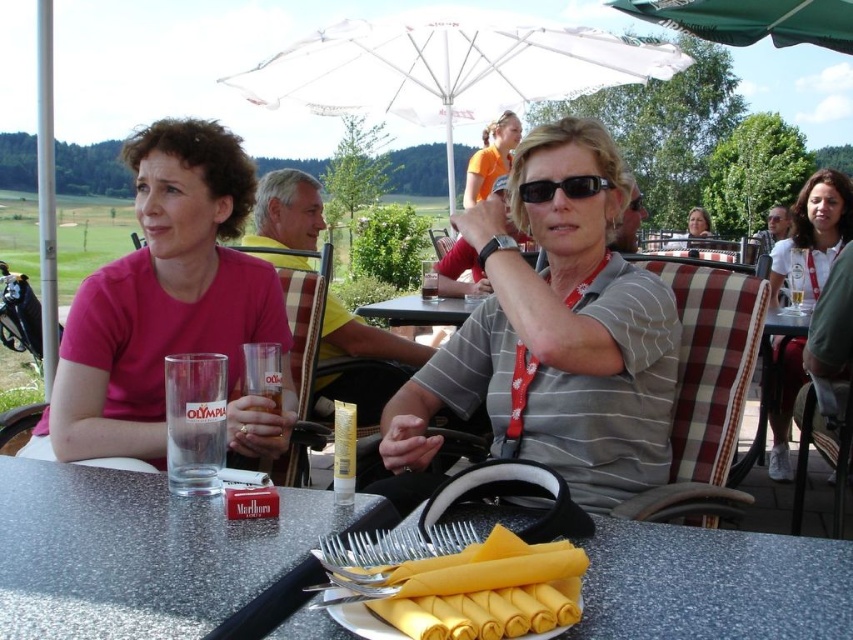
Looking at this image, you are a photographer trying to capture a shot of the gray striped shirt at center and the white fabric umbrella at upper center. Since you want both subjects in the frame, which direction should you move your camera to include both?

The gray striped shirt at center is to the right of the white fabric umbrella at upper center, so you should move your camera to the left to include both subjects in the frame.

You are a photographer trying to capture a photo of the gray striped shirt at center and the green fabric umbrella at upper center. Which object should you focus on first if you want to ensure both are in focus?

The gray striped shirt at center is much taller than the green fabric umbrella at upper center, so you should focus on the gray striped shirt at center first to ensure both are in focus.